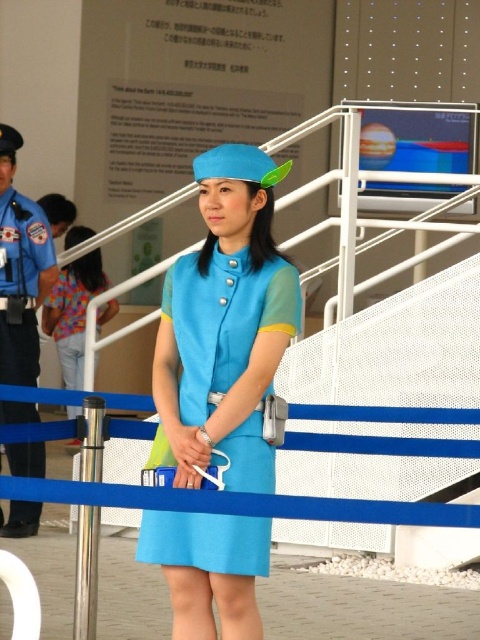
Question: Based on their relative distances, which object is nearer to the matte blue dress at center?

Choices:
 (A) blue uniform at left
 (B) matte blue dress at lower left

Answer: (A)

Question: Is matte blue dress at center positioned before matte blue dress at lower left?

Choices:
 (A) no
 (B) yes

Answer: (B)

Question: Which point is farther from the camera taking this photo?

Choices:
 (A) (144, 560)
 (B) (27, 296)

Answer: (B)

Question: Which of the following is the farthest from the observer?

Choices:
 (A) matte blue dress at lower left
 (B) blue uniform at left
 (C) matte blue dress at center

Answer: (A)

Question: Does matte blue dress at center appear on the left side of blue uniform at left?

Choices:
 (A) no
 (B) yes

Answer: (A)

Question: Can you confirm if blue uniform at left is positioned to the left of matte blue dress at lower left?

Choices:
 (A) no
 (B) yes

Answer: (A)